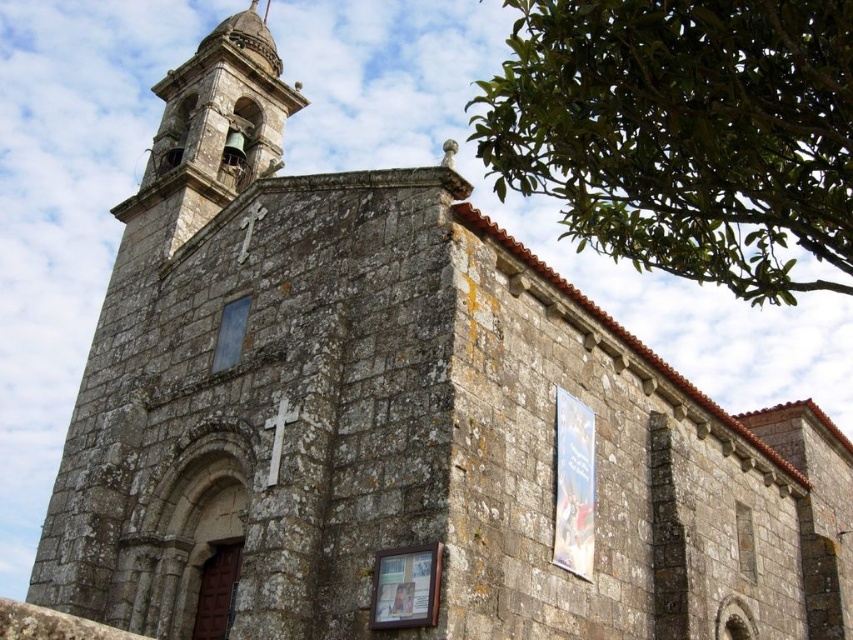
Measure the distance between green leafy tree at upper right and camera.

A distance of 26.32 meters exists between green leafy tree at upper right and camera.

Is green leafy tree at upper right below rusty stone bell tower at upper left?

Correct, green leafy tree at upper right is located below rusty stone bell tower at upper left.

Image resolution: width=853 pixels, height=640 pixels. I want to click on green leafy tree at upper right, so click(683, 132).